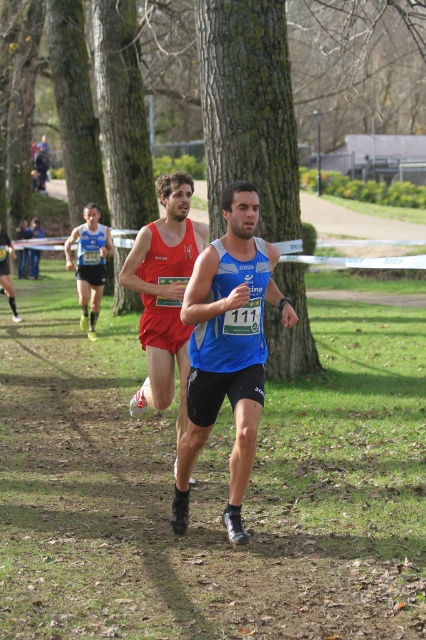
Question: Estimate the real-world distances between objects in this image. Which object is closer to the green bark tree at center?

Choices:
 (A) green mossy tree at center
 (B) matte blue tank top at center

Answer: (B)

Question: Which of these objects is positioned farthest from the green mossy tree at center?

Choices:
 (A) matte blue tank top at center
 (B) matte red singlet at center
 (C) matte red singlet at left
 (D) green bark tree at center

Answer: (D)

Question: Which object is farther from the camera taking this photo?

Choices:
 (A) green bark tree at center
 (B) matte red singlet at left
 (C) green mossy tree at center
 (D) matte red singlet at center

Answer: (B)

Question: Does green bark tree at center appear under matte red singlet at left?

Choices:
 (A) no
 (B) yes

Answer: (A)

Question: Is green mossy tree at center behind matte red singlet at left?

Choices:
 (A) yes
 (B) no

Answer: (B)

Question: Is green mossy tree at center positioned at the back of matte red singlet at left?

Choices:
 (A) no
 (B) yes

Answer: (A)